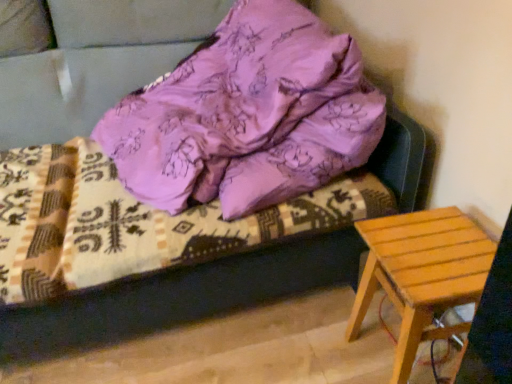
Question: Is light brown wooden stool at lower right at the back of purple satin bedding at upper center?

Choices:
 (A) yes
 (B) no

Answer: (B)

Question: Can you confirm if purple satin bedding at upper center is positioned to the left of light brown wooden stool at lower right?

Choices:
 (A) no
 (B) yes

Answer: (B)

Question: Is purple satin bedding at upper center in contact with light brown wooden stool at lower right?

Choices:
 (A) yes
 (B) no

Answer: (B)

Question: From the image's perspective, is purple satin bedding at upper center located beneath light brown wooden stool at lower right?

Choices:
 (A) yes
 (B) no

Answer: (B)

Question: From the image's perspective, is purple satin bedding at upper center over light brown wooden stool at lower right?

Choices:
 (A) yes
 (B) no

Answer: (A)

Question: From a real-world perspective, is light brown wooden stool at lower right above or below purple satin pillow at upper center?

Choices:
 (A) below
 (B) above

Answer: (A)

Question: Is light brown wooden stool at lower right in front of or behind purple satin pillow at upper center in the image?

Choices:
 (A) behind
 (B) front

Answer: (A)

Question: Is point (373, 294) closer or farther from the camera than point (288, 145)?

Choices:
 (A) farther
 (B) closer

Answer: (A)

Question: Looking at the image, does light brown wooden stool at lower right seem bigger or smaller compared to purple satin pillow at upper center?

Choices:
 (A) small
 (B) big

Answer: (A)

Question: From the image's perspective, is purple satin pillow at upper center located above or below light brown wooden stool at lower right?

Choices:
 (A) above
 (B) below

Answer: (A)

Question: Is purple satin pillow at upper center spatially inside light brown wooden stool at lower right, or outside of it?

Choices:
 (A) inside
 (B) outside

Answer: (B)

Question: In the image, is purple satin pillow at upper center on the left side or the right side of light brown wooden stool at lower right?

Choices:
 (A) left
 (B) right

Answer: (A)

Question: Is point (289, 56) closer or farther from the camera than point (480, 253)?

Choices:
 (A) closer
 (B) farther

Answer: (B)

Question: Would you say purple satin bedding at upper center is to the left or to the right of light brown wooden stool at lower right in the picture?

Choices:
 (A) left
 (B) right

Answer: (A)

Question: Looking at their shapes, would you say purple satin bedding at upper center is wider or thinner than light brown wooden stool at lower right?

Choices:
 (A) wide
 (B) thin

Answer: (A)